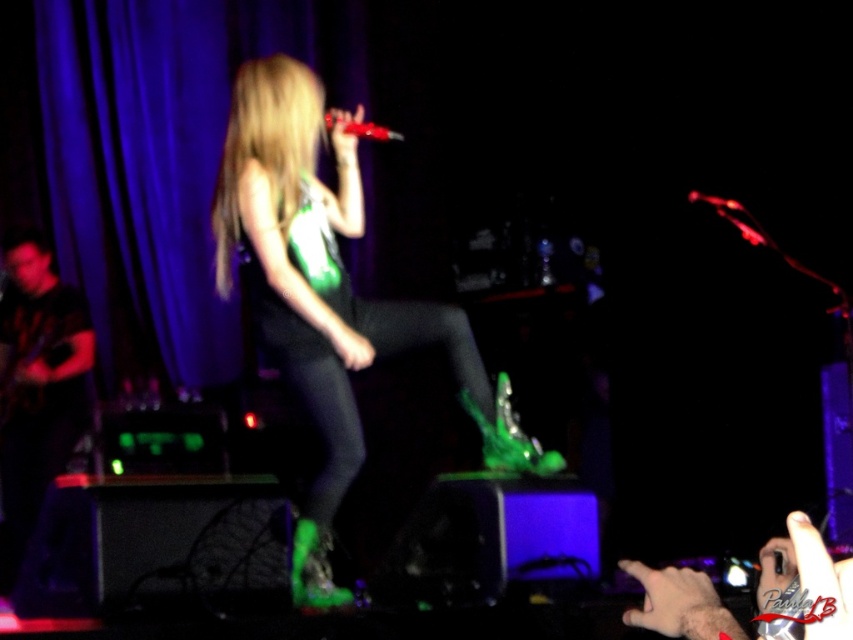
You are a stagehand setting up for a concert. You need to place a new microphone stand that can accommodate either the shiny red microphone at center or the translucent plastic microphone at upper right. Which microphone requires a taller stand?

The translucent plastic microphone at upper right requires a taller stand because it is larger than the shiny red microphone at center.

Based on the photo, you are a stagehand who needs to place a new spotlight exactly where the shiny red microphone at center is currently located. According to the coordinates provided, what are the exact 2D coordinates where you should position the spotlight?

The exact 2D coordinates for the shiny red microphone at center are at point (370, 131), so you should position the spotlight at those coordinates.

You are a stagehand setting up for a concert. You need to hang a banner that requires 3 meters of vertical space. Looking at the purple fabric curtain at upper left and the green matte boots at center, which object provides enough vertical space for the banner?

The purple fabric curtain at upper left has a greater height compared to green matte boots at center, so it provides enough vertical space for the banner requiring 3 meters.